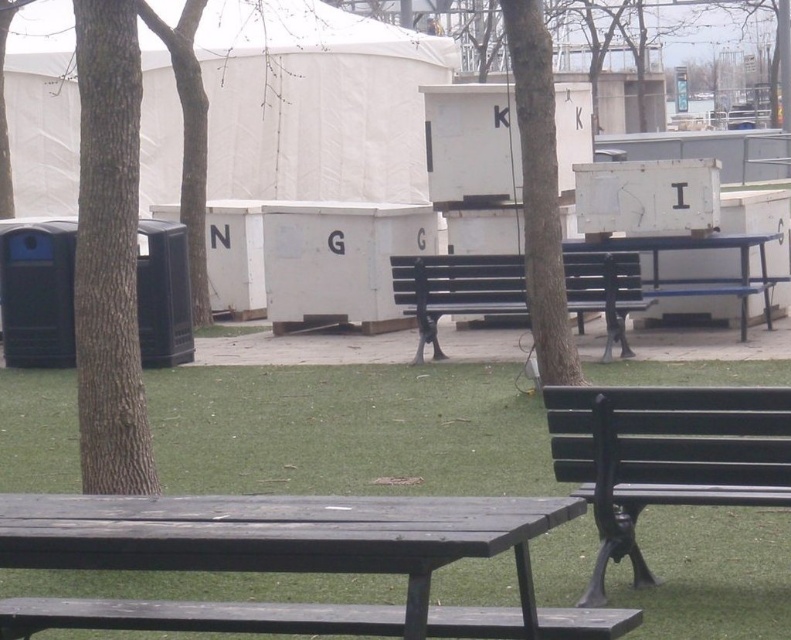
Question: Considering the relative positions of white fabric tent at center and matte black bench at center in the image provided, where is white fabric tent at center located with respect to matte black bench at center?

Choices:
 (A) below
 (B) above

Answer: (B)

Question: Estimate the real-world distances between objects in this image. Which object is farther from the matte black bench at center?

Choices:
 (A) brown textured tree at center
 (B) green grass at center
 (C) brown rough bark tree at left
 (D) white fabric tent at center

Answer: (D)

Question: Which point appears closest to the camera in this image?

Choices:
 (A) (754, 490)
 (B) (392, 282)
 (C) (86, 211)

Answer: (A)

Question: Considering the relative positions of brown rough bark tree at left and black metal bench at lower right in the image provided, where is brown rough bark tree at left located with respect to black metal bench at lower right?

Choices:
 (A) left
 (B) right

Answer: (A)

Question: Among these objects, which one is farthest from the camera?

Choices:
 (A) white fabric tent at center
 (B) black metal bench at lower right
 (C) brown textured tree at center

Answer: (A)

Question: Can you confirm if white fabric tent at center is positioned above black metal bench at lower right?

Choices:
 (A) yes
 (B) no

Answer: (A)